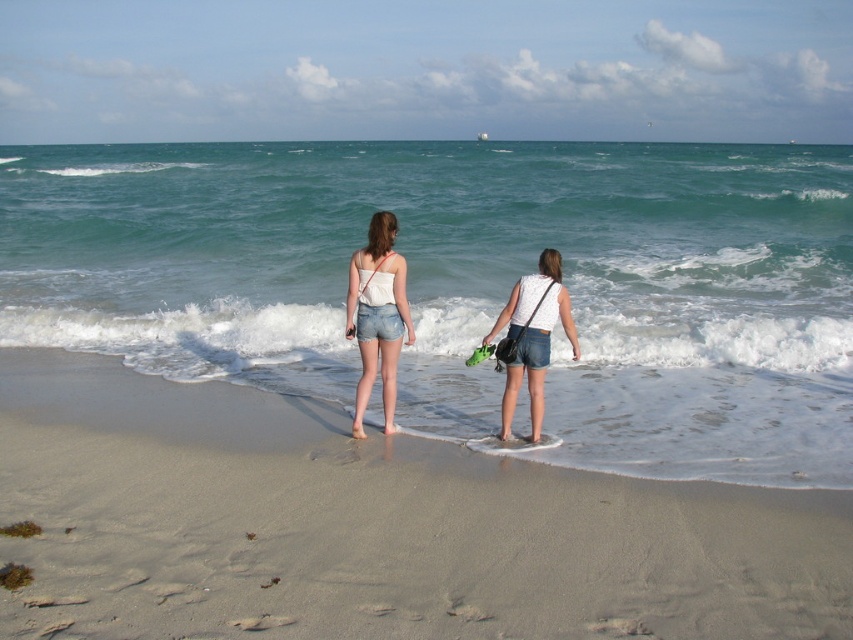
Does greenish-blue water at center have a lesser height compared to matte white tank top at center?

No.

Does greenish-blue water at center appear on the right side of matte white tank top at center?

Yes, greenish-blue water at center is to the right of matte white tank top at center.

Who is more forward, [387,168] or [358,432]?

Point [358,432]

Identify the location of greenish-blue water at center. This screenshot has width=853, height=640. (469, 284).

Based on the photo, which is more to the left, smooth sand at lower center or white matte shorts at center?

white matte shorts at center is more to the left.

Consider the image. Is smooth sand at lower center further to the viewer compared to white matte shorts at center?

No.

Where is `smooth sand at lower center`? smooth sand at lower center is located at coordinates (370, 528).

Locate an element on the screen. The width and height of the screenshot is (853, 640). smooth sand at lower center is located at coordinates (370, 528).

Can you confirm if smooth sand at lower center is positioned below matte white tank top at center?

Indeed, smooth sand at lower center is positioned under matte white tank top at center.

Does smooth sand at lower center appear on the right side of matte white tank top at center?

Correct, you'll find smooth sand at lower center to the right of matte white tank top at center.

Where is `smooth sand at lower center`? This screenshot has height=640, width=853. smooth sand at lower center is located at coordinates (370, 528).